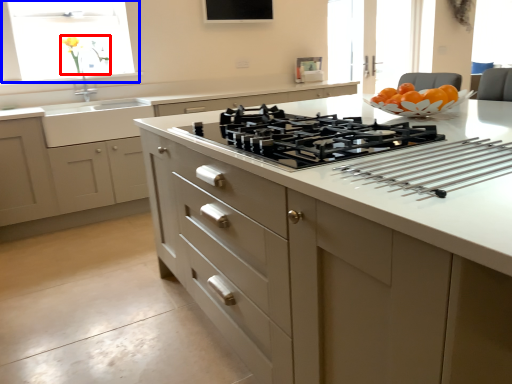
Question: Which object appears closest to the camera in this image, flower (highlighted by a red box) or window (highlighted by a blue box)?

Choices:
 (A) flower
 (B) window

Answer: (B)